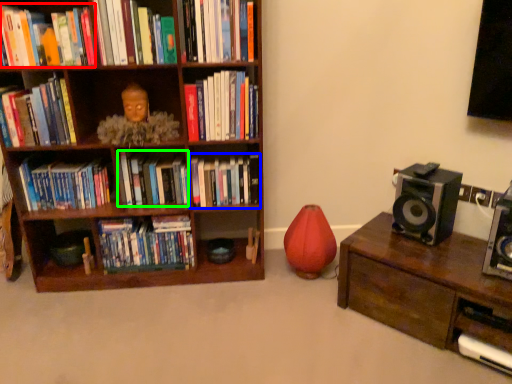
Question: Estimate the real-world distances between objects in this image. Which object is closer to book (highlighted by a red box), book (highlighted by a blue box) or book (highlighted by a green box)?

Choices:
 (A) book
 (B) book

Answer: (B)